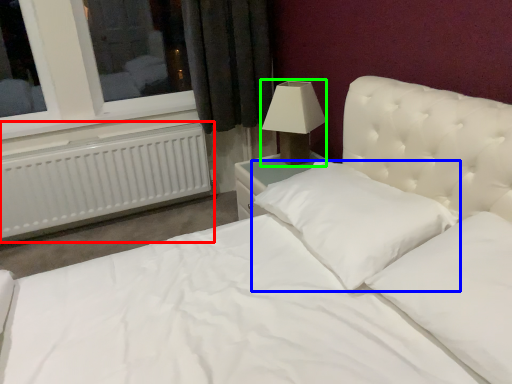
Question: Which object is positioned closest to radiator (highlighted by a red box)? Select from pillow (highlighted by a blue box) and lamp (highlighted by a green box).

Choices:
 (A) pillow
 (B) lamp

Answer: (B)